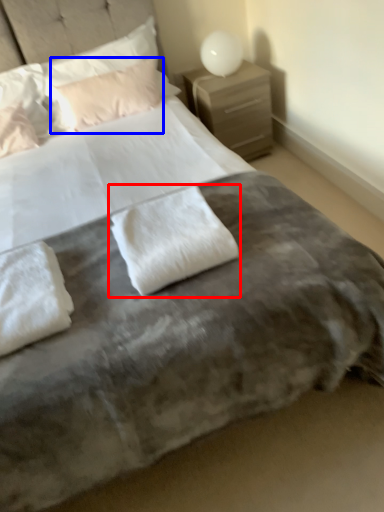
Question: Which object is further to the camera taking this photo, pillow (highlighted by a red box) or pillow (highlighted by a blue box)?

Choices:
 (A) pillow
 (B) pillow

Answer: (B)